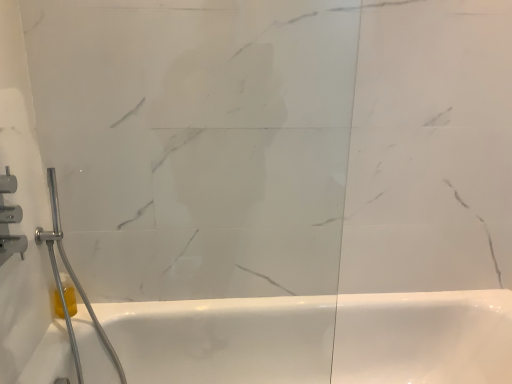
Question: Considering the positions of brushed metal shower at left, positioned as the 2th shower in back-to-front order, and yellow translucent soap at lower left in the image, is brushed metal shower at left, positioned as the 2th shower in back-to-front order, wider or thinner than yellow translucent soap at lower left?

Choices:
 (A) thin
 (B) wide

Answer: (A)

Question: From the image's perspective, is brushed metal shower at left, positioned as the 2th shower in back-to-front order, located above or below yellow translucent soap at lower left?

Choices:
 (A) above
 (B) below

Answer: (A)

Question: Which is nearer to the transparent glass door at center?

Choices:
 (A) brushed metal shower at left, positioned as the 2th shower in back-to-front order
 (B) yellow translucent soap at lower left
 (C) brushed metal shower at left, which appears as the first shower when viewed from the back

Answer: (C)

Question: Estimate the real-world distances between objects in this image. Which object is closer to the brushed metal shower at left, the 1th shower from the front?

Choices:
 (A) yellow translucent soap at lower left
 (B) brushed metal shower at left, which appears as the first shower when viewed from the back
 (C) transparent glass door at center

Answer: (B)